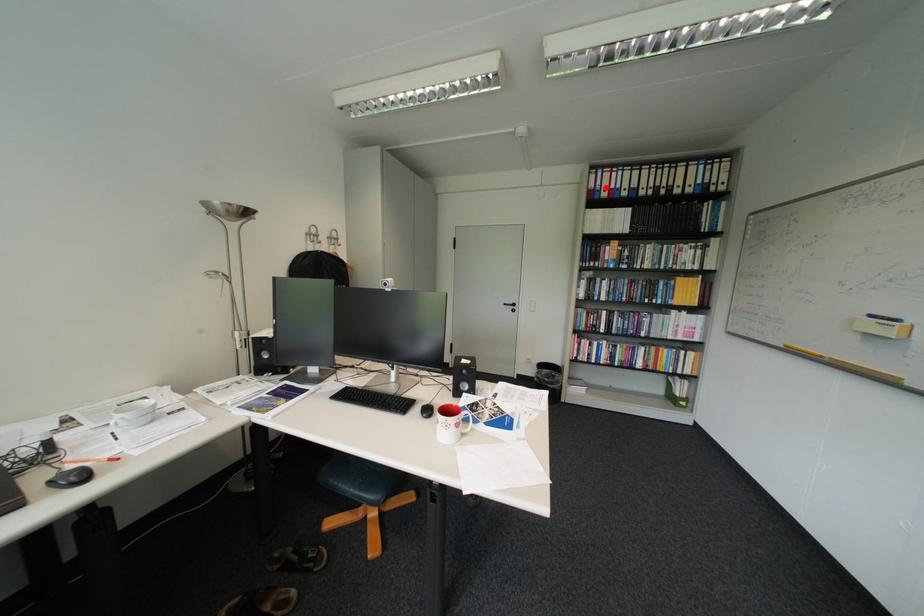
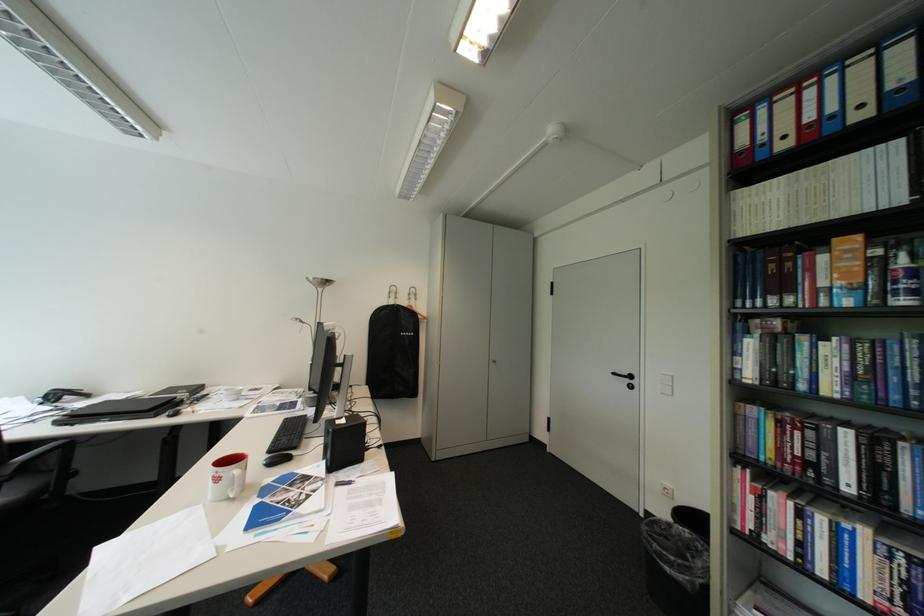
Question: I am providing you with two images of the same scene from different viewpoints. In image1, a red point is highlighted. Considering the same 3D point in image2, which of the following is correct?

Choices:
 (A) It is closer
 (B) It is farther

Answer: (B)